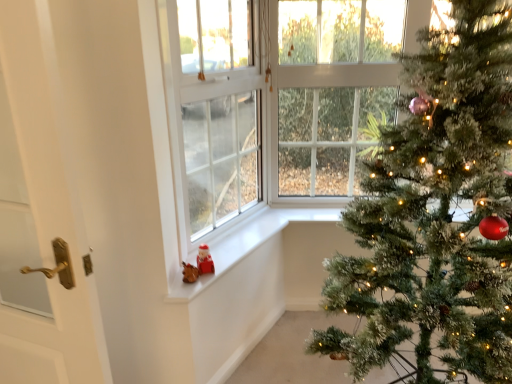
Question: Considering the positions of point [374, 304] and point [177, 274], is point [374, 304] closer or farther from the camera than point [177, 274]?

Choices:
 (A) farther
 (B) closer

Answer: (B)

Question: Looking at their shapes, would you say green textured christmas tree at right is wider or thinner than white matte window sill at lower center?

Choices:
 (A) wide
 (B) thin

Answer: (A)

Question: Based on their relative distances, which object is nearer to the white plastic window screen at lower left?

Choices:
 (A) white matte window sill at lower center
 (B) green textured christmas tree at right
 (C) white glossy door at left

Answer: (A)

Question: Which is nearer to the white glossy door at left?

Choices:
 (A) green textured christmas tree at right
 (B) white matte window sill at lower center
 (C) white plastic window screen at lower left

Answer: (B)